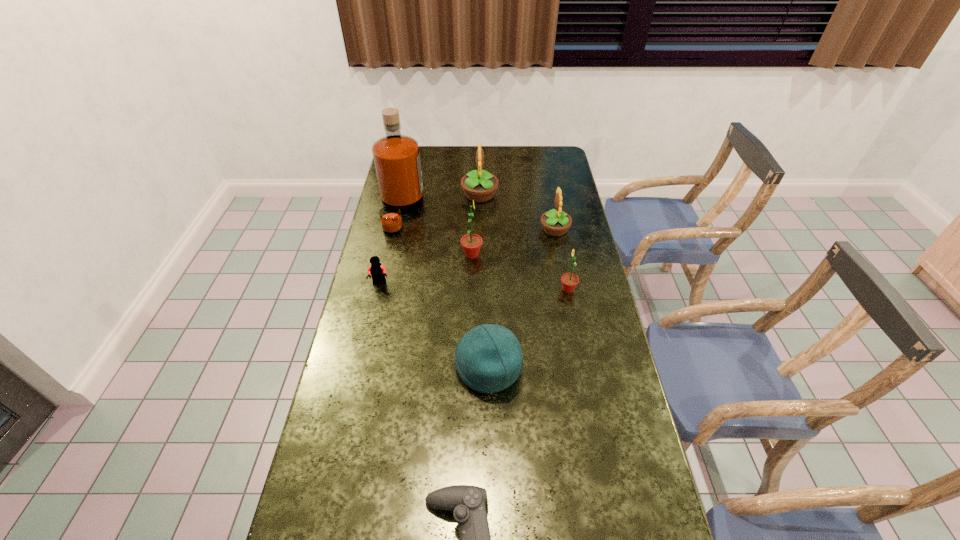
At what (x,y) coordinates should I click in order to perform the action: click on the second nearest object. Please return your answer as a coordinate pair (x, y). Looking at the image, I should click on (488, 358).

Find the location of a particular element. The height and width of the screenshot is (540, 960). Lego is located at coordinates (378, 272).

This screenshot has height=540, width=960. I want to click on black Lego, so click(x=378, y=272).

Locate an element on the screen. vacant space located on the front label of the tallest object is located at coordinates (487, 212).

At what (x,y) coordinates should I click in order to perform the action: click on free spot located on the face of the bigger yellow sunflower. Please return your answer as a coordinate pair (x, y). This screenshot has width=960, height=540. Looking at the image, I should click on (521, 195).

Where is `free space located 0.370m on the face of the bigger green sunflower`? This screenshot has height=540, width=960. free space located 0.370m on the face of the bigger green sunflower is located at coordinates (x=585, y=255).

You are a GUI agent. You are given a task and a screenshot of the screen. Output one action in this format:
    pyautogui.click(x=<x>, y=<y>)
    Task: Click on the blank space located 0.180m on the face of the right yellow sunflower
    
    Given the screenshot: What is the action you would take?
    pyautogui.click(x=493, y=230)

Where is `free region located on the face of the right yellow sunflower`? The width and height of the screenshot is (960, 540). free region located on the face of the right yellow sunflower is located at coordinates (439, 230).

Find the location of a particular element. free space located 0.130m on the face of the right yellow sunflower is located at coordinates (506, 230).

Locate an element on the screen. free space located 0.170m on the face of the smaller green sunflower is located at coordinates (509, 289).